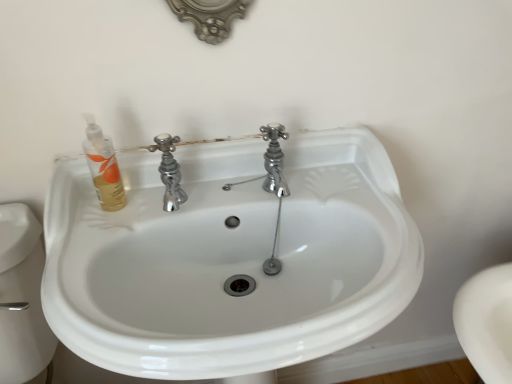
Question: From a real-world perspective, is translucent gold liquid soap at upper left physically above white glossy sink at center?

Choices:
 (A) yes
 (B) no

Answer: (A)

Question: From the image's perspective, does translucent gold liquid soap at upper left appear lower than white glossy sink at center?

Choices:
 (A) yes
 (B) no

Answer: (B)

Question: From a real-world perspective, is translucent gold liquid soap at upper left below white glossy sink at center?

Choices:
 (A) no
 (B) yes

Answer: (A)

Question: Is translucent gold liquid soap at upper left oriented towards white glossy sink at center?

Choices:
 (A) no
 (B) yes

Answer: (A)

Question: Is translucent gold liquid soap at upper left completely or partially outside of white glossy sink at center?

Choices:
 (A) no
 (B) yes

Answer: (A)

Question: Can you confirm if translucent gold liquid soap at upper left is wider than white glossy sink at center?

Choices:
 (A) no
 (B) yes

Answer: (A)

Question: Does white glossy sink at center turn towards translucent gold liquid soap at upper left?

Choices:
 (A) yes
 (B) no

Answer: (B)

Question: Does white glossy sink at center have a greater height compared to translucent gold liquid soap at upper left?

Choices:
 (A) no
 (B) yes

Answer: (B)

Question: Is the position of white glossy sink at center less distant than that of translucent gold liquid soap at upper left?

Choices:
 (A) yes
 (B) no

Answer: (A)

Question: From the image's perspective, is white glossy sink at center located beneath translucent gold liquid soap at upper left?

Choices:
 (A) yes
 (B) no

Answer: (A)

Question: Does white glossy sink at center have a smaller size compared to translucent gold liquid soap at upper left?

Choices:
 (A) no
 (B) yes

Answer: (A)

Question: Considering the relative positions of white glossy sink at center and translucent gold liquid soap at upper left in the image provided, is white glossy sink at center to the left of translucent gold liquid soap at upper left from the viewer's perspective?

Choices:
 (A) no
 (B) yes

Answer: (A)

Question: In terms of width, does translucent gold liquid soap at upper left look wider or thinner when compared to white glossy sink at center?

Choices:
 (A) wide
 (B) thin

Answer: (B)